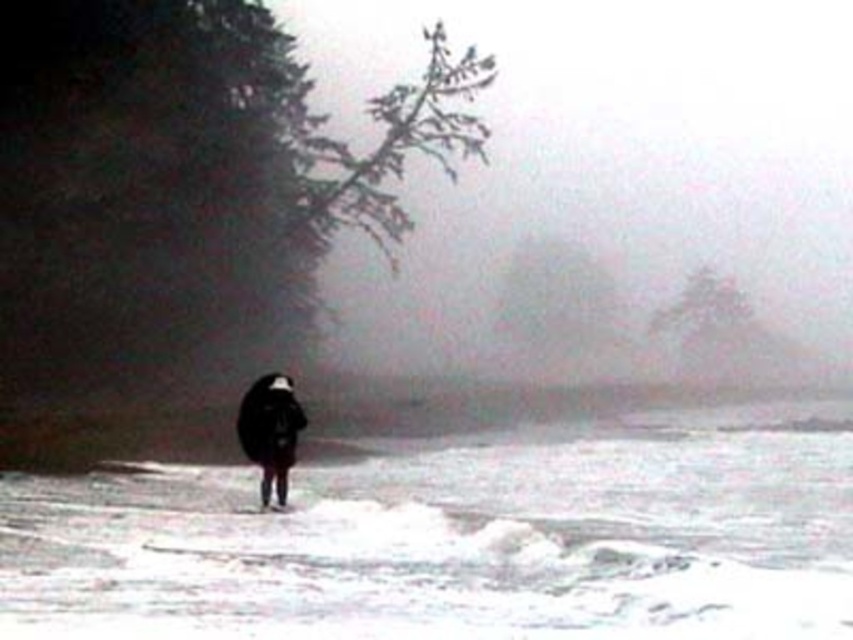
Describe the element at coordinates (451, 540) in the screenshot. I see `white frothy water at center` at that location.

Which is more to the right, white frothy water at center or black matte coat at center?

Positioned to the right is white frothy water at center.

Measure the distance between point (728, 500) and camera.

The distance of point (728, 500) from camera is 17.87 meters.

At what (x,y) coordinates should I click in order to perform the action: click on white frothy water at center. Please return your answer as a coordinate pair (x, y). The width and height of the screenshot is (853, 640). Looking at the image, I should click on (451, 540).